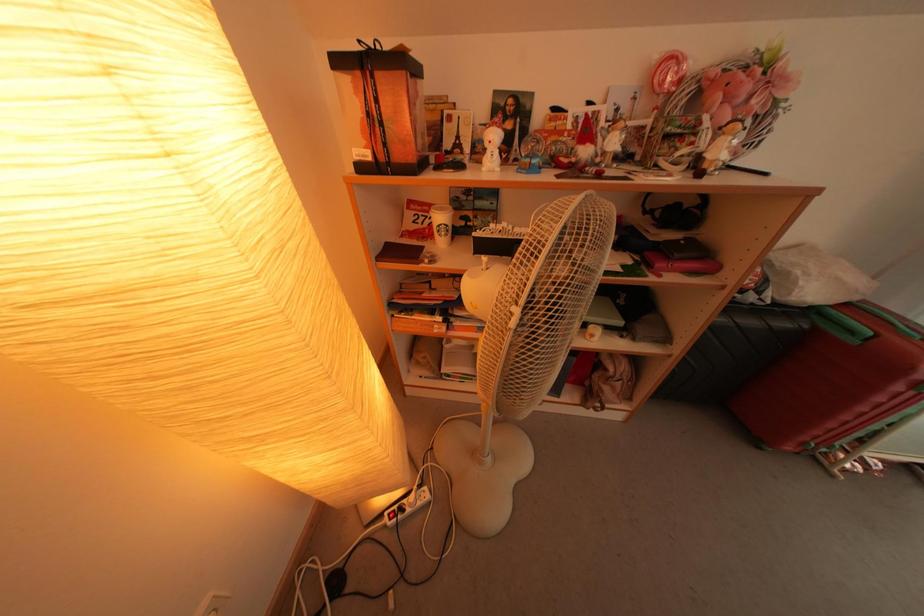
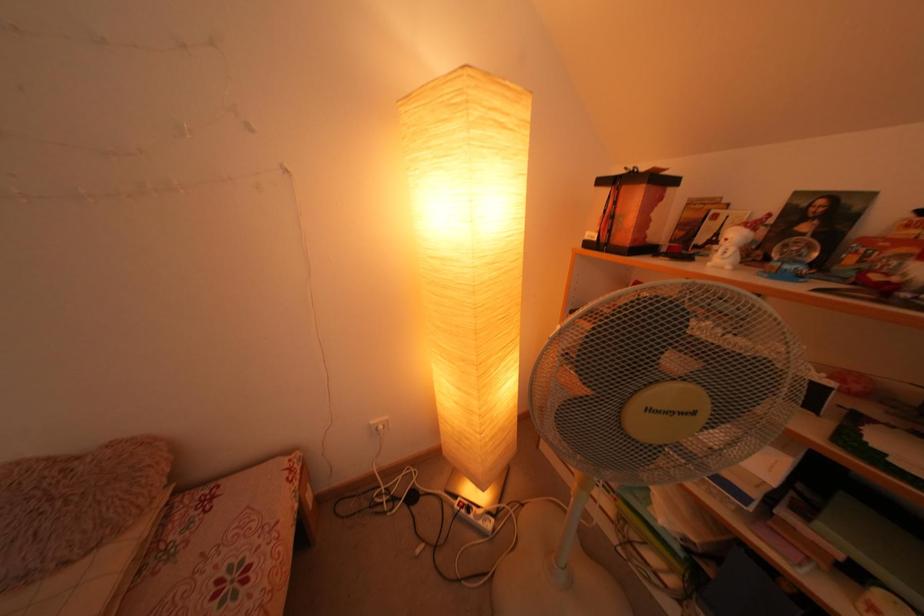
Question: The images are taken continuously from a first-person perspective. In which direction is your viewpoint rotating?

Choices:
 (A) Left
 (B) Right
 (C) Up
 (D) Down

Answer: (A)